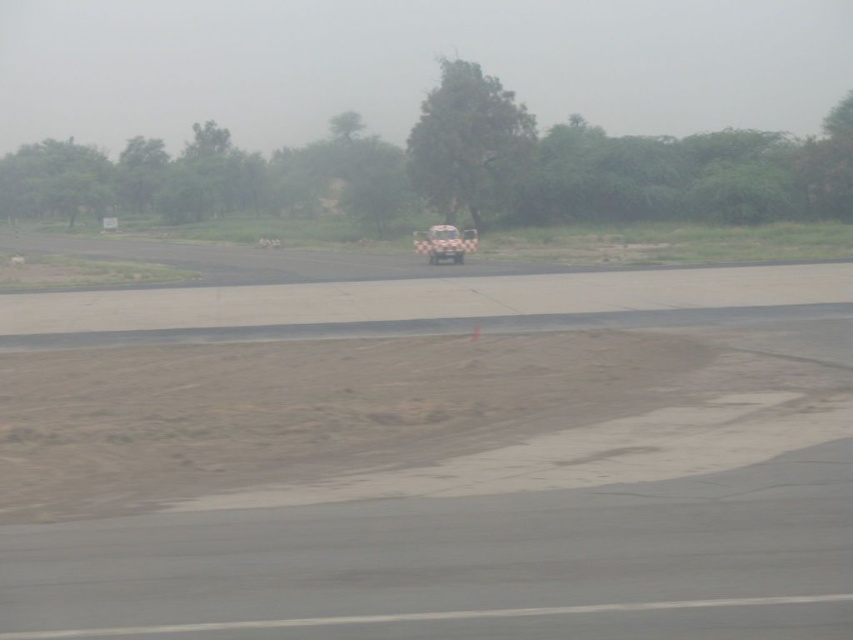
You are a delivery drone operator. Your drone has a maximum flight distance of 120 feet. You need to deliver a package from the brown sandy dirt track at lower left to the white checkered car at center. Can your drone complete this delivery without needing to recharge?

The brown sandy dirt track at lower left and white checkered car at center are 120.99 feet apart. Since the distance exceeds the drone operator mentioned maximum flight distance of 120 feet, the drone cannot complete the delivery without recharging.

Looking at this image, you are a delivery driver needing to drive your white checkered car at center onto the brown sandy dirt track at lower left. Based on the scene, can you safely make this maneuver?

The brown sandy dirt track at lower left might be wider than white checkered car at center, so it is possible that the track can accommodate the car. However, since the width is uncertain, proceed with caution to ensure a safe maneuver.